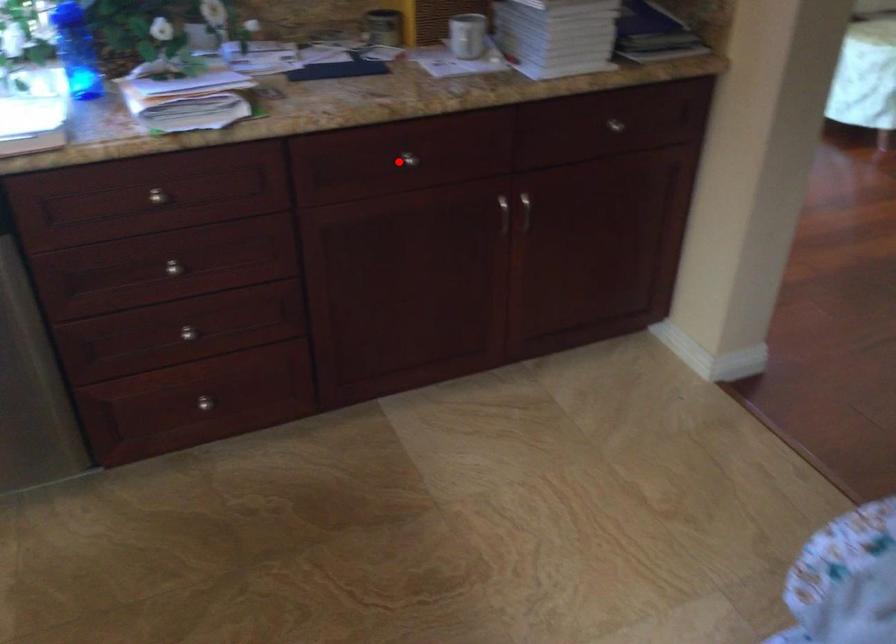
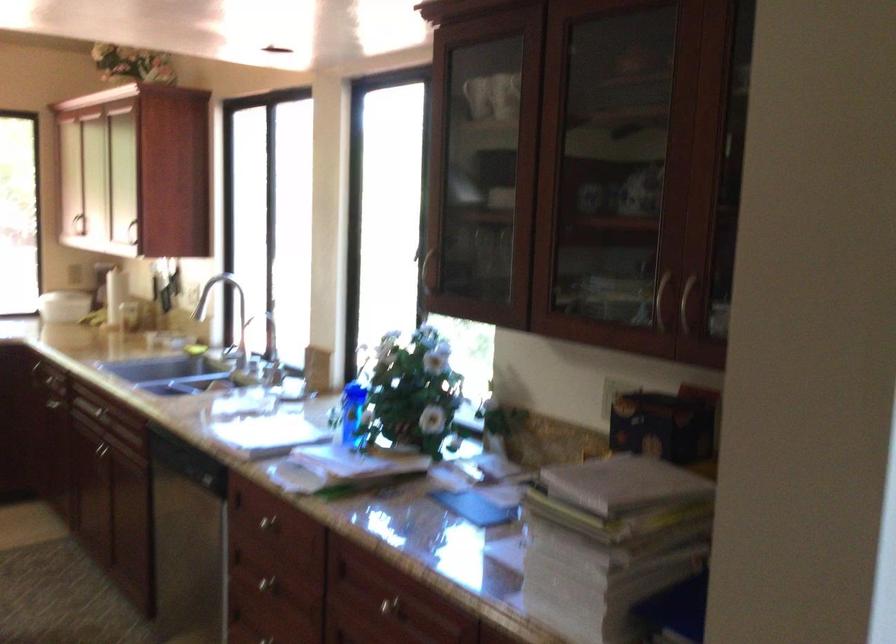
The point at the highlighted location is marked in the first image. Where is the corresponding point in the second image?

(386, 605)